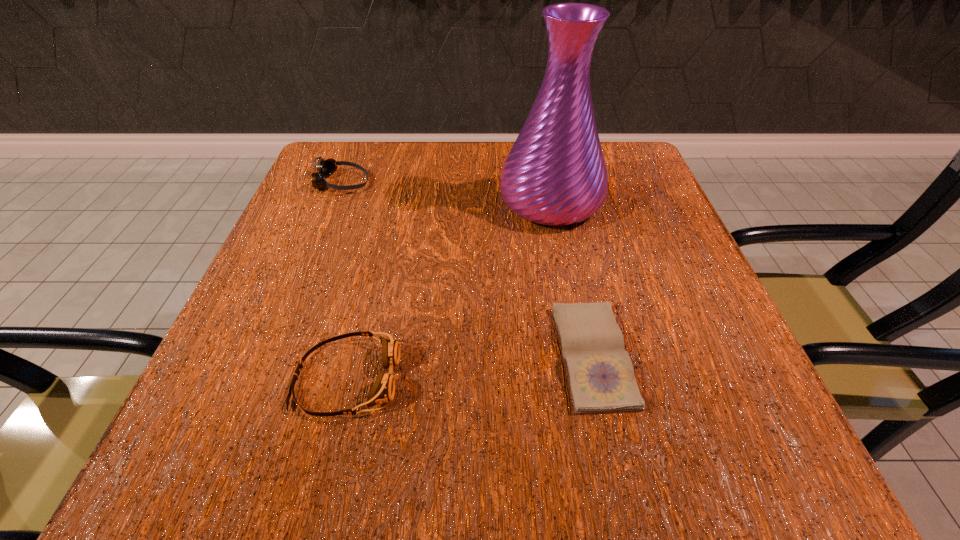
Locate an element on the screen. goggles positioned at the near edge is located at coordinates (383, 390).

At what (x,y) coordinates should I click in order to perform the action: click on diary situated at the near edge. Please return your answer as a coordinate pair (x, y). Looking at the image, I should click on (601, 377).

I want to click on vase present at the right edge, so click(x=555, y=174).

Find the location of a particular element. The height and width of the screenshot is (540, 960). diary located in the right edge section of the desktop is located at coordinates (601, 377).

In order to click on object located at the far left corner in this screenshot , I will do `click(325, 168)`.

Locate an element on the screen. object at the near left corner is located at coordinates (383, 390).

Locate an element on the screen. object located in the far right corner section of the desktop is located at coordinates (555, 174).

Where is `object at the near right corner`? object at the near right corner is located at coordinates (601, 377).

Where is `free region at the far edge of the desktop`? free region at the far edge of the desktop is located at coordinates (475, 159).

The height and width of the screenshot is (540, 960). Identify the location of vacant space at the near edge of the desktop. (419, 453).